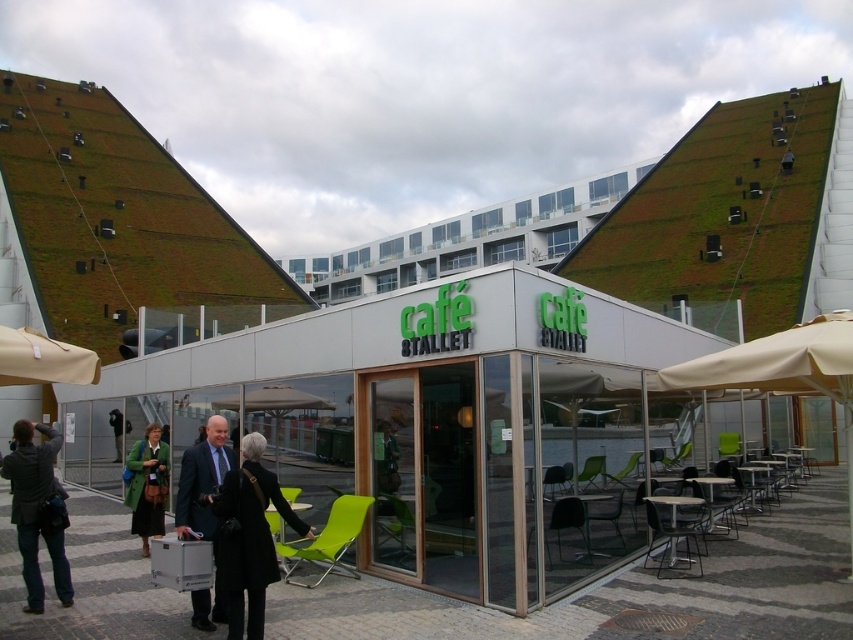
You are standing at the point closest to the entrance of the cafe. You see two points marked in the image. Which point is closer to you? The points are labeled as point (335, 545) and point (560, 556).

Point (560, 556) is closer to you because it is in front of point (335, 545).

You are standing at the entrance of the cafe and want to sit in the green fabric chair at center. Based on the coordinates provided, in which direction should you walk to reach it?

The green fabric chair at center is located at coordinates point (328, 538). Since the x coordinate is 0.842, which is closer to the right side of the image, you should walk towards the right to reach the green fabric chair at center.

You are a photographer standing at the entrance of the cafe 8TALLET. You want to take a photo that includes both the dark gray jacket at lower left and the green fabric coat at center. Which of the two items should you focus on first if you want to ensure both are in frame?

The dark gray jacket at lower left is larger in size compared to the green fabric coat at center, so you should focus on the dark gray jacket at lower left first to ensure it fits within the frame.